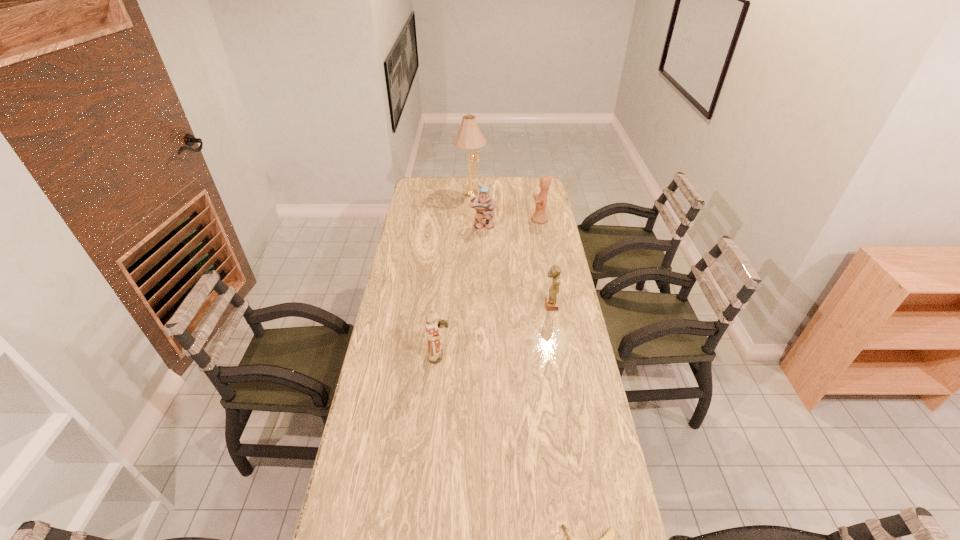
Find the location of a particular element. This screenshot has width=960, height=540. the tallest object is located at coordinates (469, 136).

You are a GUI agent. You are given a task and a screenshot of the screen. Output one action in this format:
    pyautogui.click(x=<x>, y=<y>)
    Task: Click on the farthest object
    The height and width of the screenshot is (540, 960).
    Given the screenshot: What is the action you would take?
    pyautogui.click(x=469, y=136)

You are a GUI agent. You are given a task and a screenshot of the screen. Output one action in this format:
    pyautogui.click(x=<x>, y=<y>)
    Task: Click on the second figurine from left to right
    
    Given the screenshot: What is the action you would take?
    pyautogui.click(x=484, y=204)

Locate an element on the screen. This screenshot has height=540, width=960. the leftmost figurine is located at coordinates (435, 351).

At what (x,y) coordinates should I click in order to perform the action: click on the second nearest object. Please return your answer as a coordinate pair (x, y). This screenshot has height=540, width=960. Looking at the image, I should click on (435, 351).

The height and width of the screenshot is (540, 960). Find the location of `the third farthest figurine`. the third farthest figurine is located at coordinates (551, 300).

At what (x,y) coordinates should I click in order to perform the action: click on free space located on the right of the tallest object. Please return your answer as a coordinate pair (x, y). The image size is (960, 540). Looking at the image, I should click on pos(516,192).

The height and width of the screenshot is (540, 960). I want to click on vacant region located on the front-facing side of the second figurine from left to right, so click(x=483, y=245).

I want to click on free space located on the front-facing side of the leftmost figurine, so click(469, 356).

Where is `blank space located on the front-facing side of the third farthest figurine`? This screenshot has height=540, width=960. blank space located on the front-facing side of the third farthest figurine is located at coordinates (462, 305).